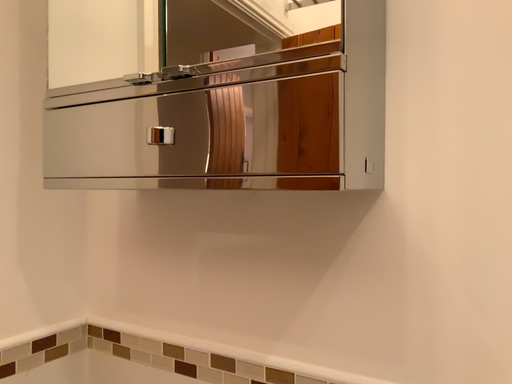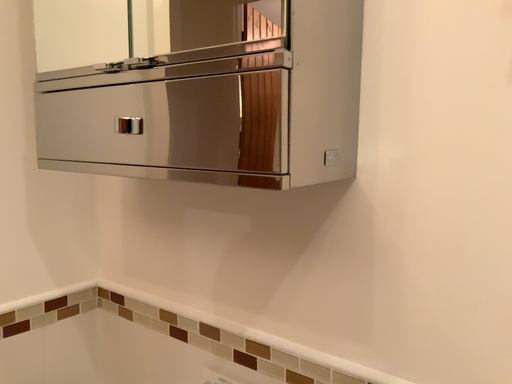
Question: Which way did the camera rotate in the video?

Choices:
 (A) rotated downward
 (B) rotated upward

Answer: (A)